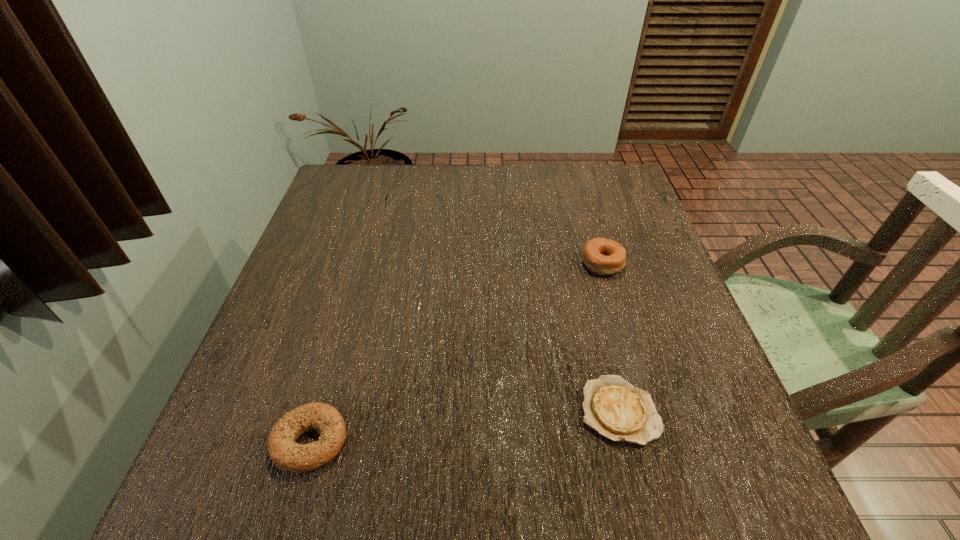
Find the location of a particular element. This screenshot has height=540, width=960. sunglasses is located at coordinates (385, 197).

Identify the location of the taller bagel. (601, 256).

The width and height of the screenshot is (960, 540). Identify the location of the right bagel. (601, 256).

Image resolution: width=960 pixels, height=540 pixels. Identify the location of the second shortest object. (286, 454).

Where is `the shorter bagel`? the shorter bagel is located at coordinates (286, 454).

Identify the location of the shortest object. This screenshot has height=540, width=960. (618, 411).

This screenshot has width=960, height=540. Identify the location of free location located in front of the lenses of the farthest object. (425, 207).

Find the location of a particular element. vacant space located on the left of the right bagel is located at coordinates (483, 263).

The height and width of the screenshot is (540, 960). In order to click on vacant area situated 0.360m on the right of the shorter bagel in this screenshot , I will do `click(559, 441)`.

This screenshot has height=540, width=960. In order to click on free location located 0.350m on the left of the shortest object in this screenshot , I will do `click(385, 411)`.